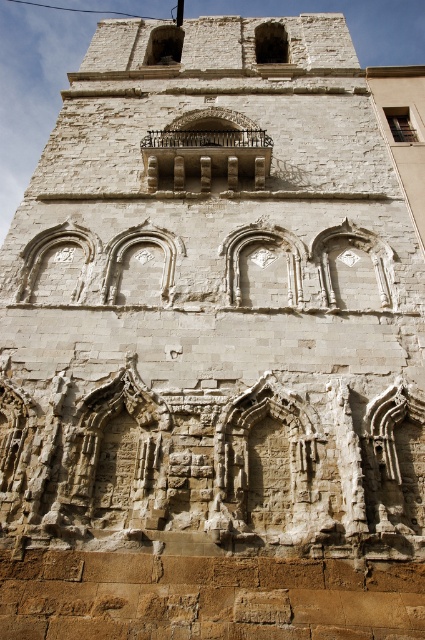
Who is shorter, white stone arch at center or matte stone window at upper right?

matte stone window at upper right

Which is in front, point (291, 237) or point (410, 132)?

Point (291, 237) is in front.

What do you see at coordinates (263, 266) in the screenshot? I see `white stone arch at center` at bounding box center [263, 266].

I want to click on white stone arch at center, so click(263, 266).

Between smooth stone window at upper center and matte stone window at upper right, which one is positioned higher?

Positioned higher is smooth stone window at upper center.

Does point (173, 26) come farther from viewer compared to point (405, 124)?

Yes, point (173, 26) is behind point (405, 124).

Identify the location of smooth stone window at upper center. The height and width of the screenshot is (640, 425). (164, 45).

Looking at this image, can you confirm if smooth stone window at upper center is thinner than stone window at upper center?

No, smooth stone window at upper center is not thinner than stone window at upper center.

Can you confirm if smooth stone window at upper center is taller than stone window at upper center?

Yes.

Which is in front, point (172, 32) or point (272, 26)?

Point (272, 26)

I want to click on smooth stone window at upper center, so click(164, 45).